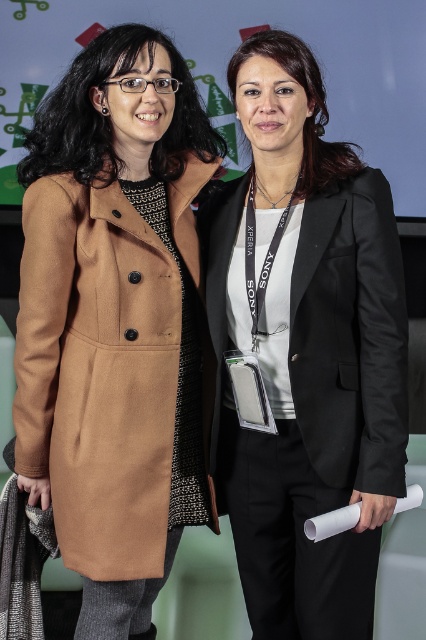
Who is more forward, (x=88, y=285) or (x=365, y=204)?

Positioned in front is point (x=365, y=204).

Is matte brown coat at left below black satin blazer at right?

Yes, matte brown coat at left is below black satin blazer at right.

What are the coordinates of `matte brown coat at left` in the screenshot? It's located at (115, 323).

In order to click on matte brown coat at left in this screenshot , I will do tap(115, 323).